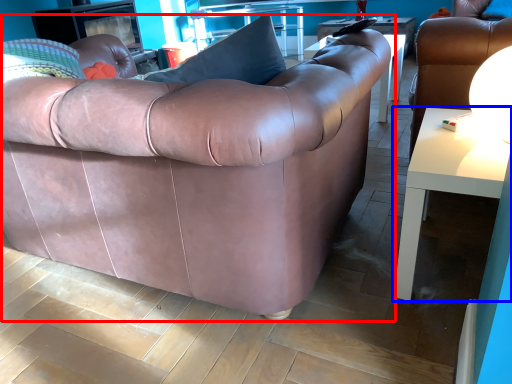
Question: Which of the following is the farthest to the observer, studio couch (highlighted by a red box) or table (highlighted by a blue box)?

Choices:
 (A) studio couch
 (B) table

Answer: (B)